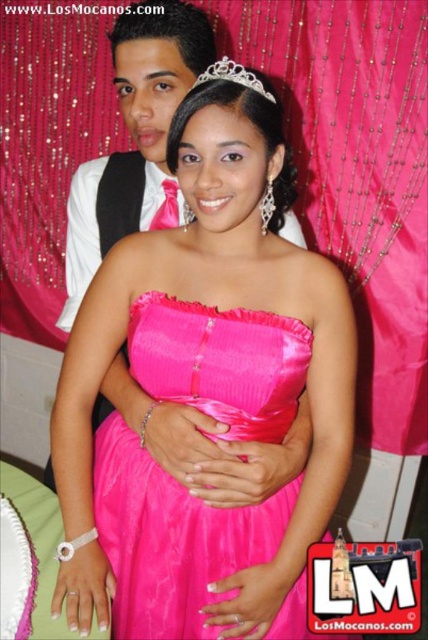
Does point (146, 634) lie behind point (199, 538)?

No, it is not.

Locate an element on the screen. Image resolution: width=428 pixels, height=640 pixels. pink satin dress at center is located at coordinates (205, 394).

Locate an element on the screen. The height and width of the screenshot is (640, 428). pink satin dress at center is located at coordinates (205, 394).

Is point (154, 344) closer to camera compared to point (232, 74)?

No.

Who is shorter, satin dress at center or silver metallic tiara at upper center?

silver metallic tiara at upper center

Identify the location of satin dress at center. The height and width of the screenshot is (640, 428). pyautogui.click(x=172, y=538).

Can you confirm if pink satin dress at center is positioned to the left of silver metallic tiara at upper center?

Indeed, pink satin dress at center is positioned on the left side of silver metallic tiara at upper center.

Which is more to the left, pink satin dress at center or silver metallic tiara at upper center?

Positioned to the left is pink satin dress at center.

Is point (241, 109) positioned behind point (211, 65)?

No, (241, 109) is closer to viewer.

Where is `pink satin dress at center`? pink satin dress at center is located at coordinates (205, 394).